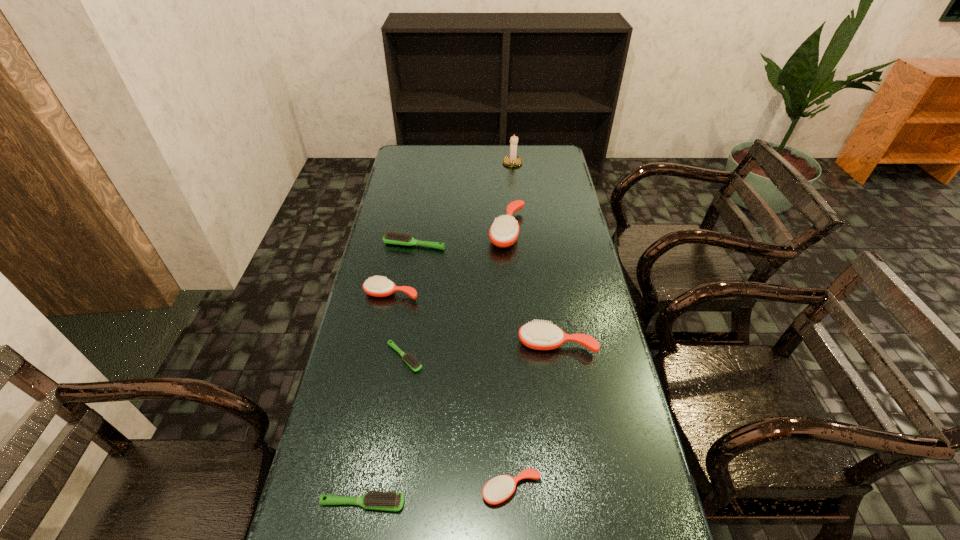
You are a GUI agent. You are given a task and a screenshot of the screen. Output one action in this format:
    pyautogui.click(x=<x>, y=<y>)
    Task: Click on the seventh tallest object
    
    Given the screenshot: What is the action you would take?
    pyautogui.click(x=389, y=501)

Where is `the nearest light hairbrush`? the nearest light hairbrush is located at coordinates (389, 501).

Where is `the second nearest light hairbrush`? the second nearest light hairbrush is located at coordinates (415, 365).

Find the location of a particular element. The height and width of the screenshot is (540, 960). the smallest light hairbrush is located at coordinates (415, 365).

Identify the location of free spot located on the handle side of the farthest object. (516, 202).

Where is `free region located 0.250m on the left of the biggest orange hairbrush`? free region located 0.250m on the left of the biggest orange hairbrush is located at coordinates (421, 231).

Identify the location of free spot located 0.200m on the back of the second biggest orange hairbrush. (547, 282).

Where is `vacant space located on the back of the fifth nearest object`? The height and width of the screenshot is (540, 960). vacant space located on the back of the fifth nearest object is located at coordinates (399, 252).

Find the location of `free space located on the front of the biggest light hairbrush`. free space located on the front of the biggest light hairbrush is located at coordinates (405, 299).

The height and width of the screenshot is (540, 960). I want to click on free spot located 0.320m on the left of the smallest orange hairbrush, so click(337, 490).